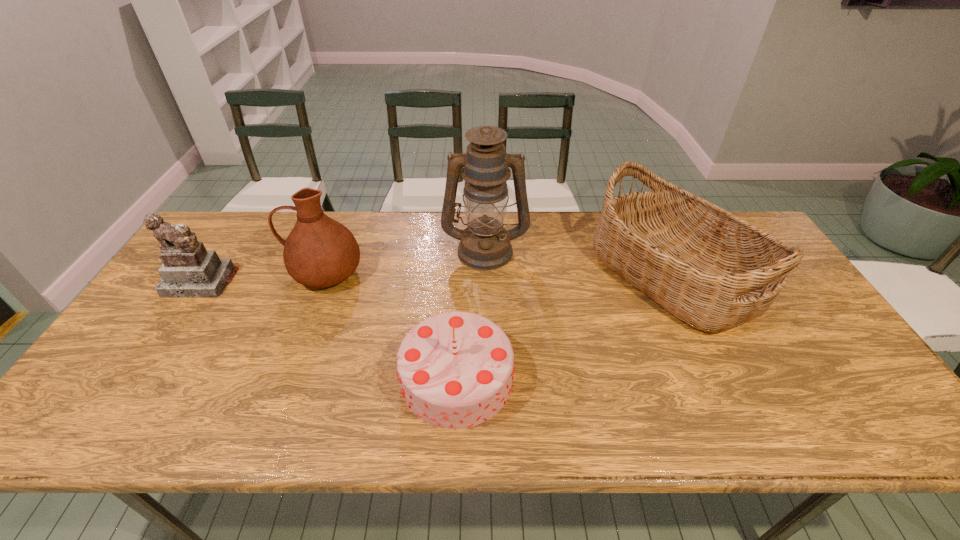
This screenshot has height=540, width=960. In order to click on free space located 0.090m on the front-facing side of the figurine in this screenshot , I will do `click(174, 322)`.

Where is `blank space located on the right of the birthday cake`? blank space located on the right of the birthday cake is located at coordinates (586, 377).

Where is `oil lamp located at the far edge`? oil lamp located at the far edge is located at coordinates (484, 245).

Locate an element on the screen. The image size is (960, 540). pitcher that is at the far edge is located at coordinates (319, 252).

Locate an element on the screen. This screenshot has width=960, height=540. basket present at the far edge is located at coordinates (714, 271).

Where is `object present at the near edge`? The width and height of the screenshot is (960, 540). object present at the near edge is located at coordinates pos(455,369).

Locate an element on the screen. The image size is (960, 540). object present at the left edge is located at coordinates (189, 270).

I want to click on object that is positioned at the right edge, so click(714, 271).

I want to click on object that is at the far right corner, so click(714, 271).

In the image, there is a desktop. Identify the location of vacant region at the far edge. (565, 234).